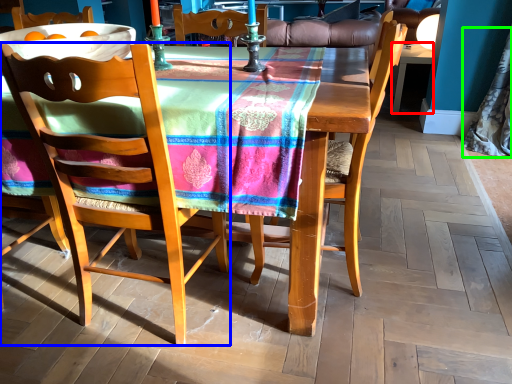
Question: Considering the real-world distances, which object is farthest from desk (highlighted by a red box)? chair (highlighted by a blue box) or curtain (highlighted by a green box)?

Choices:
 (A) chair
 (B) curtain

Answer: (A)